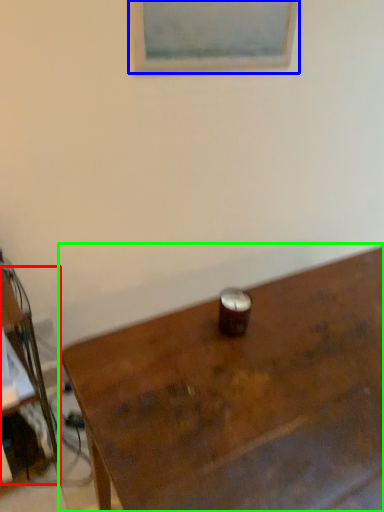
Question: Estimate the real-world distances between objects in this image. Which object is closer to desk (highlighted by a red box), picture frame (highlighted by a blue box) or table (highlighted by a green box)?

Choices:
 (A) picture frame
 (B) table

Answer: (B)